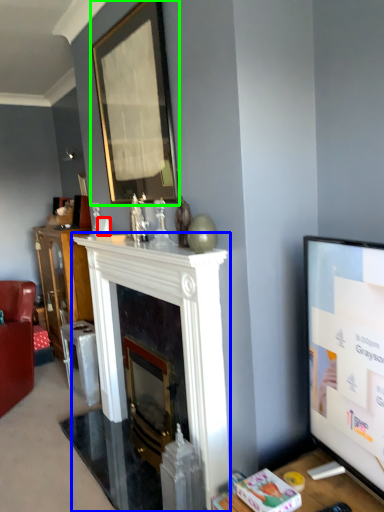
Question: Based on their relative distances, which object is farther from coffee cup (highlighted by a red box)? Choose from fireplace (highlighted by a blue box) and picture frame (highlighted by a green box).

Choices:
 (A) fireplace
 (B) picture frame

Answer: (B)